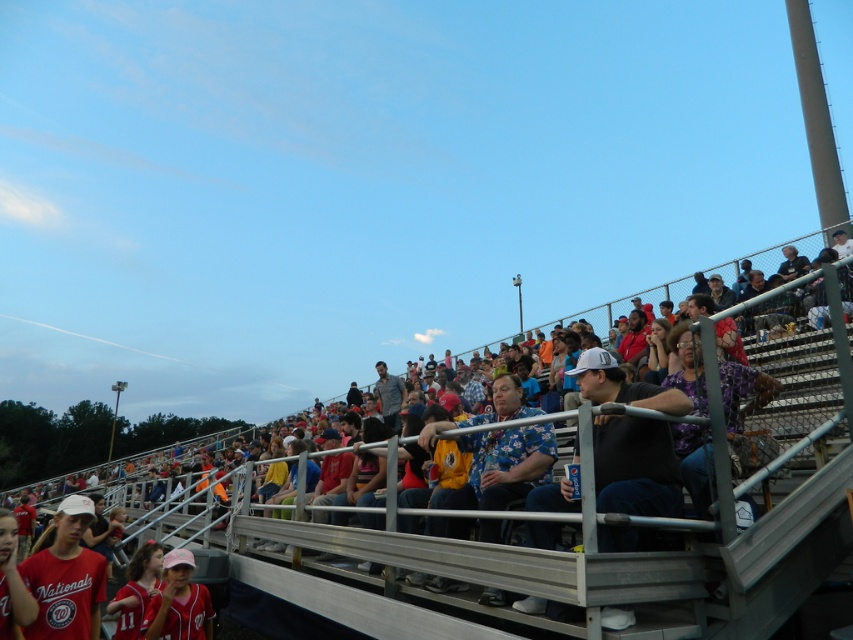
Is matte red jersey at lower left positioned in front of matte pink cap at lower center?

Yes, matte red jersey at lower left is in front of matte pink cap at lower center.

Is point (32, 627) closer to camera compared to point (209, 620)?

That is True.

The width and height of the screenshot is (853, 640). Find the location of `matte red jersey at lower left`. matte red jersey at lower left is located at coordinates (67, 577).

Can you confirm if blue fabric seats at center is thinner than matte pink cap at lower center?

No, blue fabric seats at center is not thinner than matte pink cap at lower center.

Between blue fabric seats at center and matte pink cap at lower center, which one is positioned higher?

matte pink cap at lower center is above.

Identify the location of blue fabric seats at center. (572, 554).

This screenshot has width=853, height=640. In order to click on blue fabric seats at center in this screenshot , I will do `click(572, 554)`.

Based on the photo, is blue fabric seats at center thinner than matte red jersey at lower left?

Incorrect, blue fabric seats at center's width is not less than matte red jersey at lower left's.

Between blue fabric seats at center and matte red jersey at lower left, which one is positioned higher?

Positioned higher is matte red jersey at lower left.

The image size is (853, 640). Identify the location of blue fabric seats at center. (572, 554).